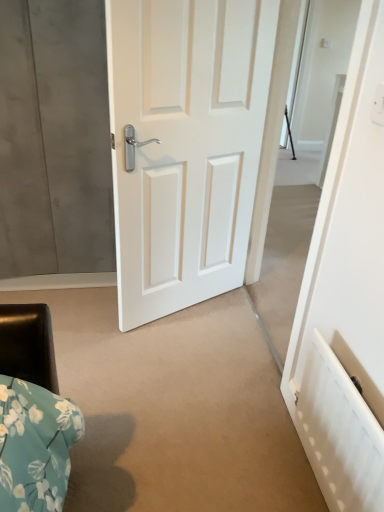
Identify the location of white textured radiator at lower right. (338, 433).

You are a GUI agent. You are given a task and a screenshot of the screen. Output one action in this format:
    pyautogui.click(x=<x>, y=<y>)
    Task: Click on the white glossy door at center
    This screenshot has width=384, height=512.
    Given the screenshot: What is the action you would take?
    pyautogui.click(x=185, y=145)

This screenshot has height=512, width=384. I want to click on matte white door at center, so click(x=175, y=409).

Identify the location of radiator located on the right of white glossy door at center. The width and height of the screenshot is (384, 512). (338, 433).

In the scene shown: Is white textured radiator at lower right aimed at white glossy door at center?

No, white textured radiator at lower right is not facing towards white glossy door at center.

Between white textured radiator at lower right and white glossy door at center, which one appears on the left side from the viewer's perspective?

Positioned to the left is white glossy door at center.

Is white textured radiator at lower right spatially inside white glossy door at center, or outside of it?

white textured radiator at lower right is outside white glossy door at center.

Considering the relative sizes of matte white door at center and white textured radiator at lower right in the image provided, is matte white door at center thinner than white textured radiator at lower right?

In fact, matte white door at center might be wider than white textured radiator at lower right.

Which is closer, (75, 502) or (328, 499)?

Point (75, 502) is farther from the camera than point (328, 499).

Between matte white door at center and white textured radiator at lower right, which one appears on the right side from the viewer's perspective?

Positioned to the right is white textured radiator at lower right.

Which of these two, matte white door at center or white textured radiator at lower right, is smaller?

Smaller between the two is white textured radiator at lower right.

From the picture: What's the angular difference between matte white door at center and white glossy door at center's facing directions?

64 degrees separate the facing orientations of matte white door at center and white glossy door at center.

Does point (102, 288) come farther from viewer compared to point (179, 15)?

Yes, it is behind point (179, 15).

Based on the photo, could you tell me if matte white door at center is turned towards white glossy door at center?

No, matte white door at center does not turn towards white glossy door at center.

Is white glossy door at center a part of matte white door at center?

No, white glossy door at center is not a part of matte white door at center.

From a real-world perspective, is white glossy door at center positioned over matte white door at center based on gravity?

Yes, from a real-world perspective, white glossy door at center is on top of matte white door at center.

Can you confirm if white glossy door at center is positioned to the left of matte white door at center?

In fact, white glossy door at center is to the right of matte white door at center.

Is matte white door at center at the back of white glossy door at center?

white glossy door at center does not have its back to matte white door at center.

Does point (336, 407) appear closer or farther from the camera than point (126, 335)?

Point (336, 407) is closer to the camera than point (126, 335).

Which is correct: white textured radiator at lower right is inside matte white door at center, or outside of it?

white textured radiator at lower right lies outside matte white door at center.

Considering the relative positions of white textured radiator at lower right and matte white door at center in the image provided, is white textured radiator at lower right to the left of matte white door at center from the viewer's perspective?

No, white textured radiator at lower right is not to the left of matte white door at center.

The width and height of the screenshot is (384, 512). Find the location of `radiator below the white glossy door at center (from the image's perspective)`. radiator below the white glossy door at center (from the image's perspective) is located at coordinates (338, 433).

From a real-world perspective, which object rests below the other?

From a 3D spatial view, white textured radiator at lower right is below.

Is white glossy door at center far away from white textured radiator at lower right?

No.

At what (x,y) coordinates should I click in order to perform the action: click on radiator lying in front of the white glossy door at center. Please return your answer as a coordinate pair (x, y). Looking at the image, I should click on (338, 433).

I want to click on concrete behind the white textured radiator at lower right, so click(175, 409).

Looking at the image, which one is located closer to white textured radiator at lower right, white glossy door at center or matte white door at center?

matte white door at center is closer to white textured radiator at lower right.

When comparing their distances from matte white door at center, does white glossy door at center or white textured radiator at lower right seem further?

The object further to matte white door at center is white glossy door at center.

Looking at this image, which object lies further to the anchor point white glossy door at center, white textured radiator at lower right or matte white door at center?

white textured radiator at lower right lies further to white glossy door at center than the other object.

Which object lies further to the anchor point matte white door at center, white textured radiator at lower right or white glossy door at center?

white glossy door at center is positioned further to the anchor matte white door at center.

Estimate the real-world distances between objects in this image. Which object is further from white glossy door at center, matte white door at center or white textured radiator at lower right?

white textured radiator at lower right.

Looking at the image, which one is located closer to white textured radiator at lower right, matte white door at center or white glossy door at center?

Among the two, matte white door at center is located nearer to white textured radiator at lower right.

Where is `concrete between white glossy door at center and white textured radiator at lower right from top to bottom`? Image resolution: width=384 pixels, height=512 pixels. concrete between white glossy door at center and white textured radiator at lower right from top to bottom is located at coordinates (175, 409).